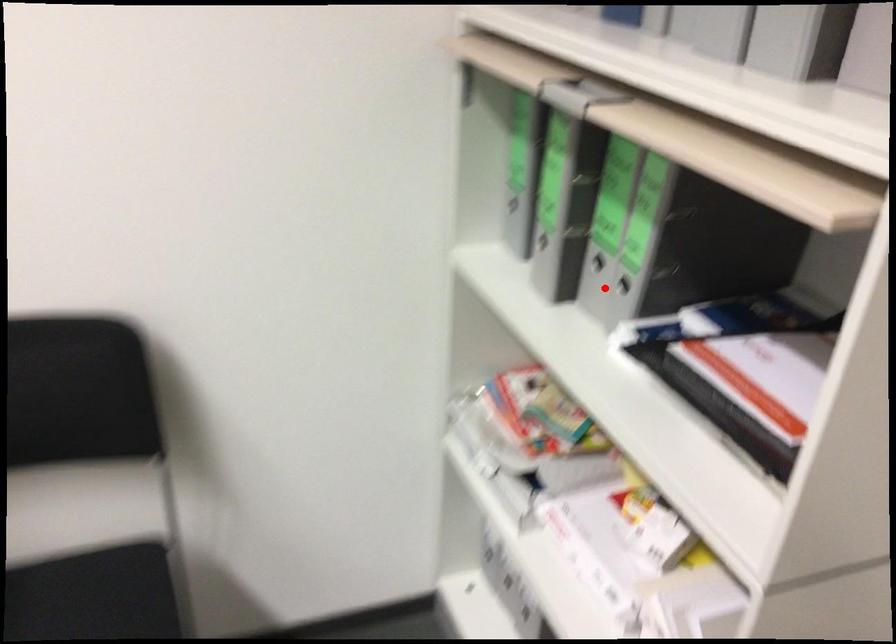
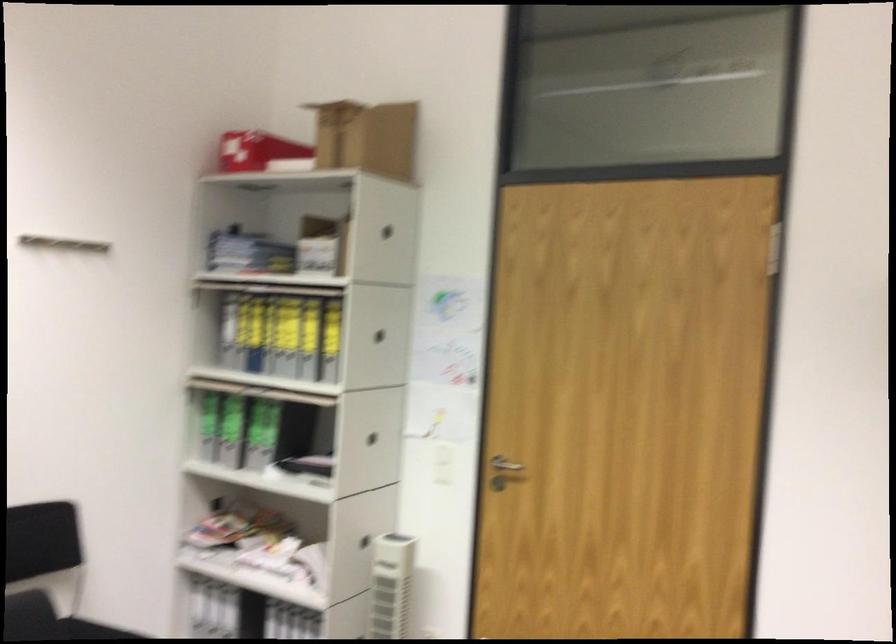
Question: I am providing you with two images of the same scene from different viewpoints. A red point is shown in image1. For the corresponding object point in image2, is it positioned nearer or farther from the camera?

Choices:
 (A) Nearer
 (B) Farther

Answer: (B)